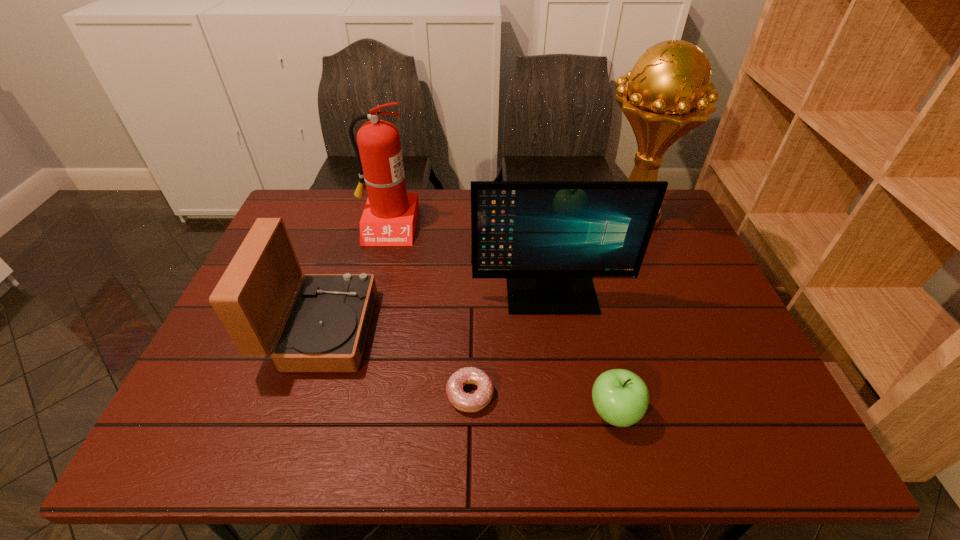
Identify the location of free region located 0.350m on the screen side of the monitor. The image size is (960, 540). (576, 448).

Locate an element on the screen. This screenshot has width=960, height=540. free space located on the face of the phonograph record is located at coordinates (467, 329).

Identify the location of vacant space located on the right of the second shortest object. The width and height of the screenshot is (960, 540). (678, 412).

Identify the location of vacant position located 0.230m on the right of the shortest object. Image resolution: width=960 pixels, height=540 pixels. (599, 394).

You are a GUI agent. You are given a task and a screenshot of the screen. Output one action in this format:
    pyautogui.click(x=<x>, y=<y>)
    Task: Click on the trophy_cup that is positioned at the far edge
    
    Given the screenshot: What is the action you would take?
    pyautogui.click(x=665, y=98)

At what (x,y) coordinates should I click in order to perform the action: click on fire extinguisher present at the far edge. Please return your answer as a coordinate pair (x, y). Image resolution: width=960 pixels, height=540 pixels. Looking at the image, I should click on (389, 218).

This screenshot has width=960, height=540. Find the location of `apple that is at the near edge`. apple that is at the near edge is located at coordinates (621, 398).

At what (x,y) coordinates should I click in order to perform the action: click on doughnut at the near edge. Please return your answer as a coordinate pair (x, y). Looking at the image, I should click on (465, 402).

The width and height of the screenshot is (960, 540). I want to click on object present at the left edge, so click(325, 330).

Where is `object that is at the right edge`? object that is at the right edge is located at coordinates (665, 98).